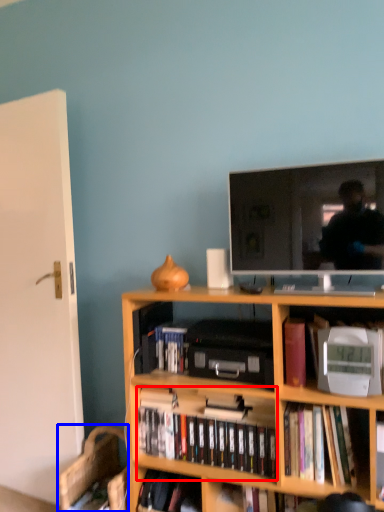
Question: Which of the following is the closest to the observer, book (highlighted by a red box) or computer chair (highlighted by a blue box)?

Choices:
 (A) book
 (B) computer chair

Answer: (A)